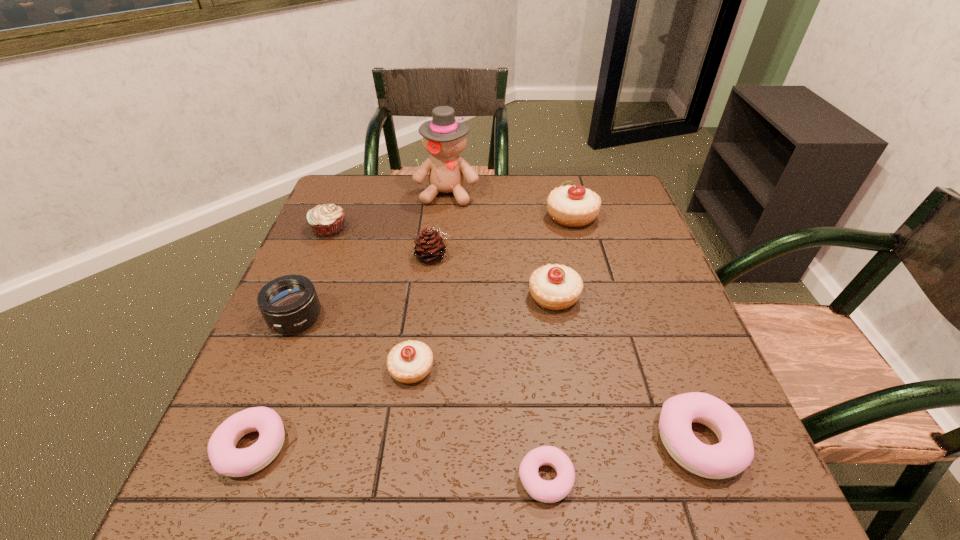
Identify which pink pastry is the closest to the tallest object. Please provide its 2D coordinates. Your answer should be formatted as a tuple, i.e. [(x, y)], where the tuple contains the x and y coordinates of a point satisfying the conditions above.

[(226, 459)]

This screenshot has width=960, height=540. Identify the location of free space that satisfies the following two spatial constraints: 1. with a leaf charm attached to the second pink pastry from left to right; 2. on the right side of the pinecone. (408, 478).

You are a GUI agent. You are given a task and a screenshot of the screen. Output one action in this format:
    pyautogui.click(x=<x>, y=<y>)
    Task: Click on the free space that satisfies the following two spatial constraints: 1. on the front side of the leftmost beige pastry; 2. on the right side of the second pink pastry from right to left
    The width and height of the screenshot is (960, 540).
    Given the screenshot: What is the action you would take?
    pyautogui.click(x=396, y=478)

Locate an element on the screen. free space in the image that satisfies the following two spatial constraints: 1. on the side of the telephoto lens with brand markings and control switches; 2. on the left side of the smallest pink pastry is located at coordinates (229, 478).

This screenshot has height=540, width=960. I want to click on vacant region that satisfies the following two spatial constraints: 1. with a leaf charm attached to the brown pinecone; 2. on the left side of the shortest pastry, so click(408, 478).

Find the location of `free space that satisfies the following two spatial constraints: 1. on the back side of the smallest pink pastry; 2. on the left side of the second biggest beige pastry`. free space that satisfies the following two spatial constraints: 1. on the back side of the smallest pink pastry; 2. on the left side of the second biggest beige pastry is located at coordinates (526, 296).

The height and width of the screenshot is (540, 960). I want to click on vacant space that satisfies the following two spatial constraints: 1. on the back side of the ninth shortest object; 2. on the left side of the muffin, so click(335, 216).

Find the location of a particular element. vacant space that satisfies the following two spatial constraints: 1. with a leaf charm attached to the brown pinecone; 2. on the back side of the second tallest pastry is located at coordinates click(430, 296).

At what (x,y) coordinates should I click in order to perform the action: click on free region that satisfies the following two spatial constraints: 1. on the front side of the biggest pink pastry; 2. on the right side of the muffin. Please return your answer as a coordinate pair (x, y). The height and width of the screenshot is (540, 960). Looking at the image, I should click on (242, 441).